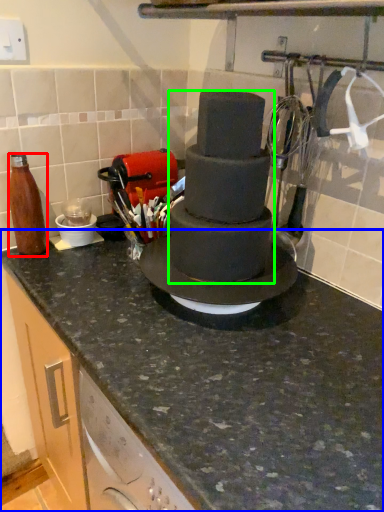
Question: Based on their relative distances, which object is nearer to bottle (highlighted by a red box)? Choose from countertop (highlighted by a blue box) and chocolate cake (highlighted by a green box).

Choices:
 (A) countertop
 (B) chocolate cake

Answer: (B)